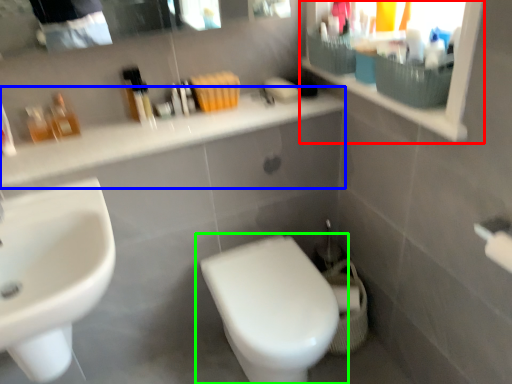
Question: Based on their relative distances, which object is farther from medicine cabinet (highlighted by a red box)? Choose from counter top (highlighted by a blue box) and toilet (highlighted by a green box).

Choices:
 (A) counter top
 (B) toilet

Answer: (B)